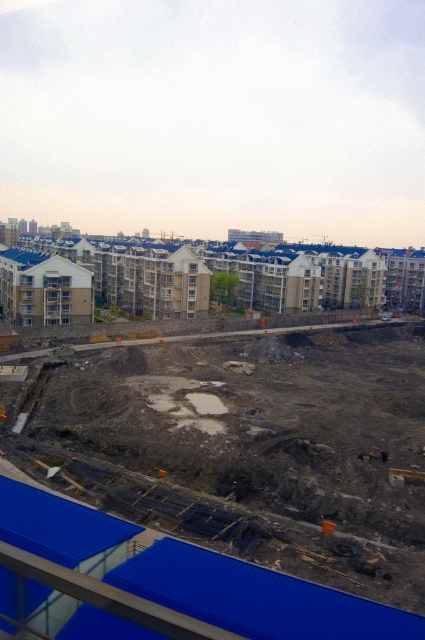
Who is taller, dull gray concrete at center or white concrete buildings at upper center?

white concrete buildings at upper center is taller.

Between point (223, 509) and point (130, 275), which one is positioned behind?

The point (130, 275) is more distant.

Locate an element on the screen. dull gray concrete at center is located at coordinates (252, 448).

Find the location of a particular element. Image resolution: width=425 pixels, height=640 pixels. dull gray concrete at center is located at coordinates (252, 448).